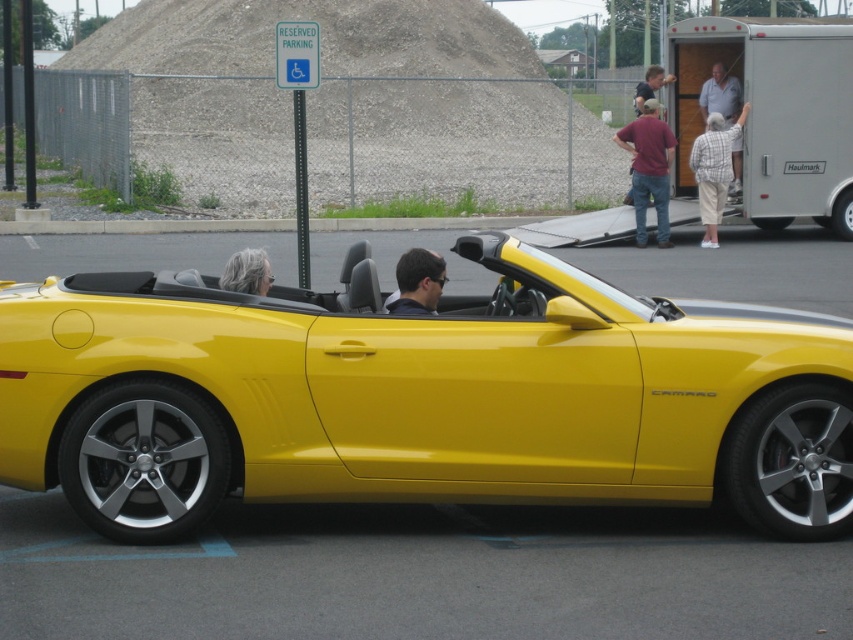
Question: Does plaid shirt at center appear on the left side of plaid shirt at upper right?

Choices:
 (A) yes
 (B) no

Answer: (A)

Question: Which point is closer to the camera?

Choices:
 (A) plaid shirt at center
 (B) gray hair at center
 (C) plaid shirt at upper right

Answer: (B)

Question: Is shiny yellow convertible at center to the left of plaid shirt at center from the viewer's perspective?

Choices:
 (A) yes
 (B) no

Answer: (A)

Question: Is plaid shirt at center in front of matte black hair at center?

Choices:
 (A) yes
 (B) no

Answer: (B)

Question: Which point is closer to the camera taking this photo?

Choices:
 (A) (264, 266)
 (B) (412, 268)

Answer: (B)

Question: Which point is farther to the camera?

Choices:
 (A) matte black hair at center
 (B) shiny yellow convertible at center
 (C) matte red shirt at center

Answer: (C)